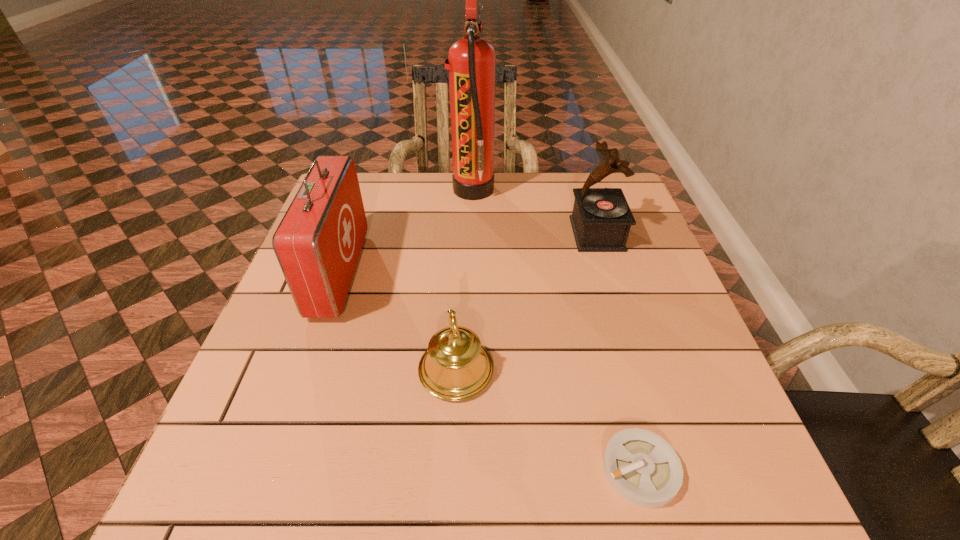
Identify the location of fire extinguisher. (471, 62).

Identify the location of the farthest object. This screenshot has width=960, height=540. (471, 62).

You are a GUI agent. You are given a task and a screenshot of the screen. Output one action in this format:
    pyautogui.click(x=<x>, y=<y>)
    Task: Click on the first-aid kit
    
    Given the screenshot: What is the action you would take?
    pyautogui.click(x=318, y=242)

You are a GUI agent. You are given a task and a screenshot of the screen. Output one action in this format:
    pyautogui.click(x=<x>, y=<y>)
    Task: Click on the phonograph_record
    Image resolution: width=960 pixels, height=540 pixels.
    Given the screenshot: What is the action you would take?
    pyautogui.click(x=601, y=219)

The width and height of the screenshot is (960, 540). Identify the location of bell. (456, 367).

You are a GUI agent. You are given a task and a screenshot of the screen. Output one action in this format:
    pyautogui.click(x=<x>, y=<y>)
    Task: Click on the second nearest object
    The image size is (960, 540).
    Given the screenshot: What is the action you would take?
    pyautogui.click(x=456, y=367)

Image resolution: width=960 pixels, height=540 pixels. In order to click on the shortest object in this screenshot , I will do `click(644, 469)`.

Locate an element on the screen. The height and width of the screenshot is (540, 960). the nearest object is located at coordinates (644, 469).

Find the location of a particular element. vacant area located with the nozzle pointing from the back of the fire extinguisher is located at coordinates (628, 190).

Locate an element on the screen. The height and width of the screenshot is (540, 960). vacant region located 0.220m on the side of the leftmost object with the first aid cross symbol is located at coordinates (449, 273).